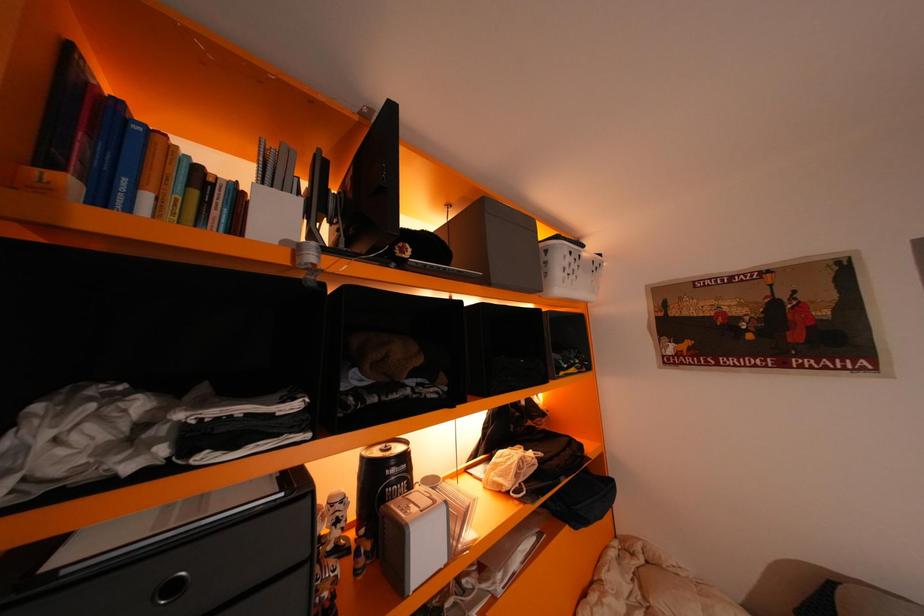
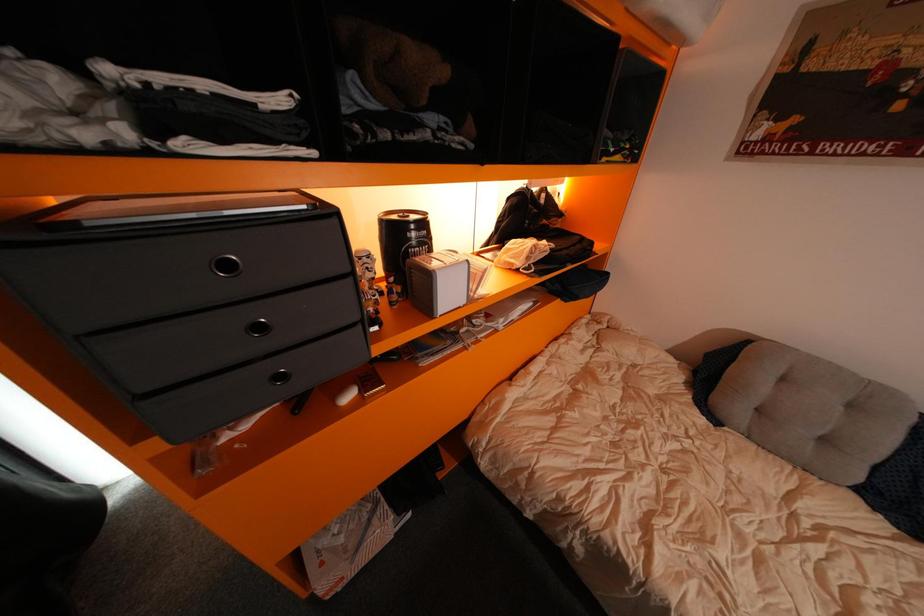
Question: How did the camera likely rotate?

Choices:
 (A) Left
 (B) Right
 (C) Up
 (D) Down

Answer: (D)